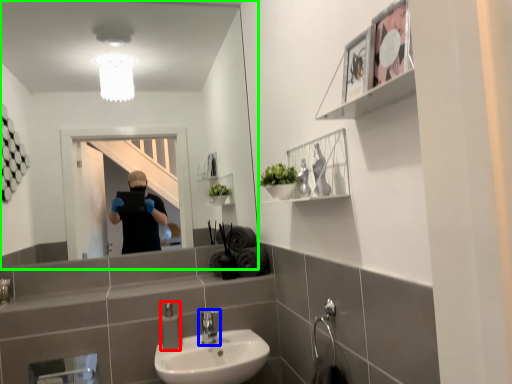
Question: Which object is positioned closest to soap dispenser (highlighted by a red box)? Select from tap (highlighted by a blue box) and mirror (highlighted by a green box).

Choices:
 (A) tap
 (B) mirror

Answer: (A)